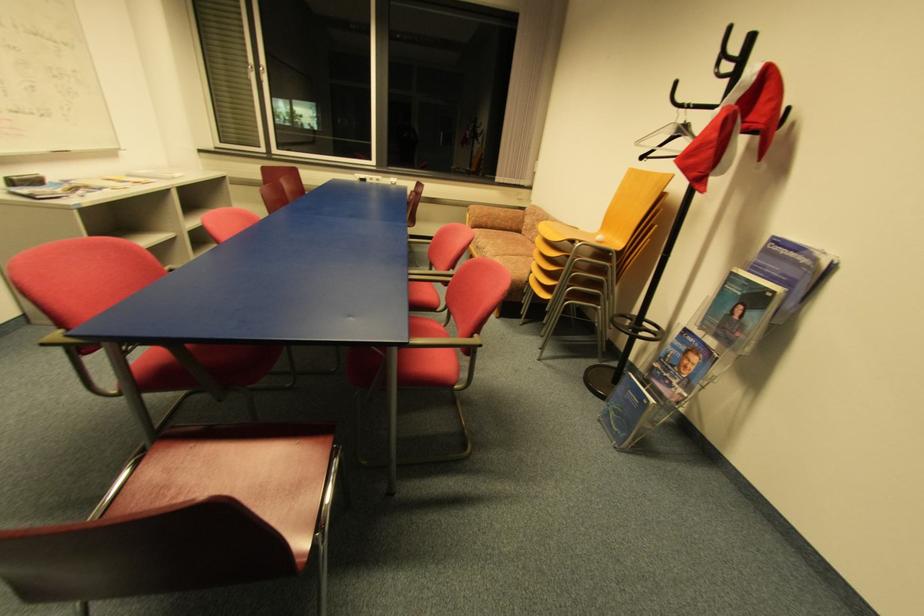
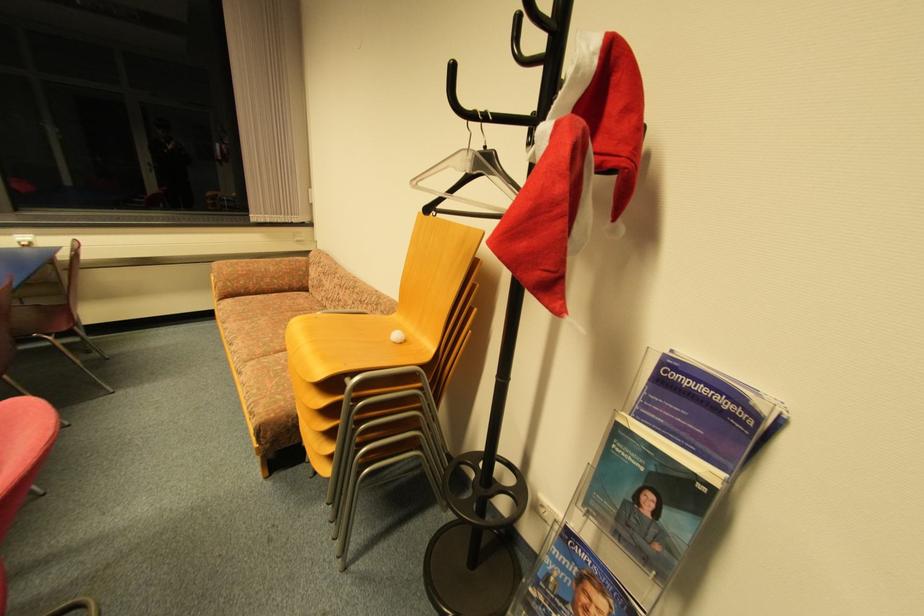
Locate, in the second image, the point that corresponds to pixel 603 238 in the first image.

(399, 337)